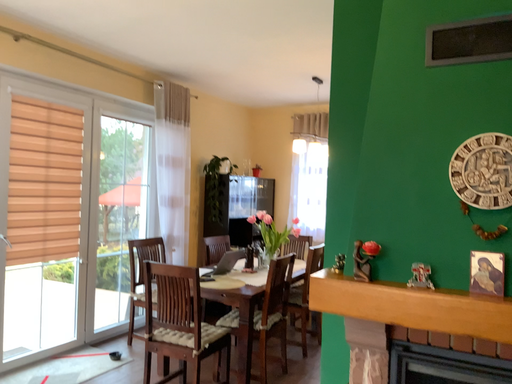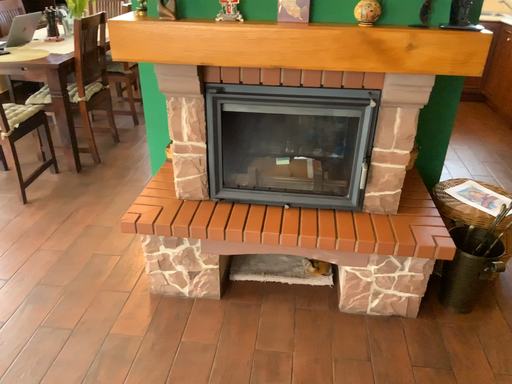
Question: Which way did the camera rotate in the video?

Choices:
 (A) rotated downward
 (B) rotated upward

Answer: (A)